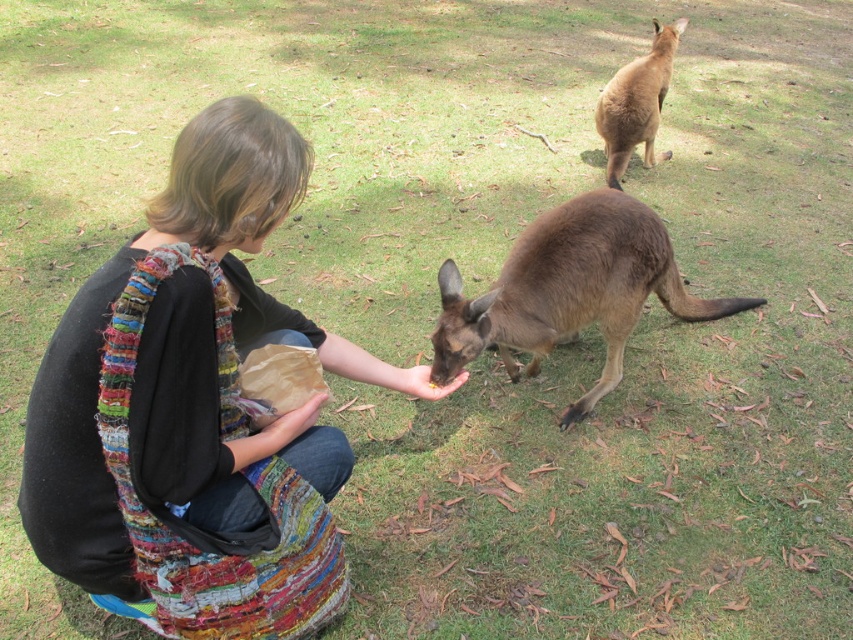
Between point (212, 186) and point (265, 390), which one is positioned behind?

The point (265, 390) is behind.

Can you confirm if multicolored woven vest at center is positioned to the right of brown crinkled paper bag at lower center?

Incorrect, multicolored woven vest at center is not on the right side of brown crinkled paper bag at lower center.

This screenshot has height=640, width=853. What do you see at coordinates (192, 410) in the screenshot? I see `multicolored woven vest at center` at bounding box center [192, 410].

Where is `multicolored woven vest at center`? multicolored woven vest at center is located at coordinates (192, 410).

Which is behind, point (625, 92) or point (270, 417)?

Positioned behind is point (625, 92).

Which is more to the right, brown furry kangaroo at upper right or brown crinkled paper bag at lower center?

brown furry kangaroo at upper right

Locate an element on the screen. brown furry kangaroo at upper right is located at coordinates (636, 102).

Does point (113, 564) come closer to viewer compared to point (640, 140)?

Yes, point (113, 564) is in front of point (640, 140).

Does multicolored woven vest at center appear on the left side of brown furry kangaroo at upper right?

Indeed, multicolored woven vest at center is positioned on the left side of brown furry kangaroo at upper right.

This screenshot has width=853, height=640. Describe the element at coordinates (192, 410) in the screenshot. I see `multicolored woven vest at center` at that location.

Identify the location of multicolored woven vest at center. (x=192, y=410).